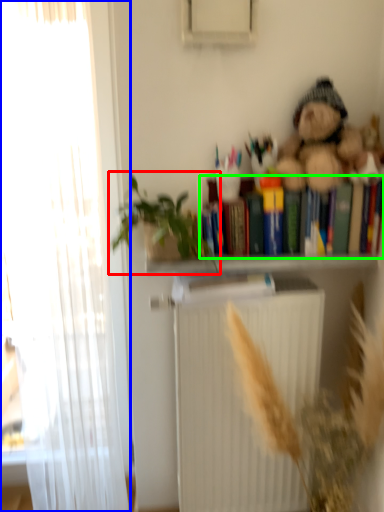
Question: Considering the real-world distances, which object is farthest from houseplant (highlighted by a red box)? curtain (highlighted by a blue box) or book (highlighted by a green box)?

Choices:
 (A) curtain
 (B) book

Answer: (B)